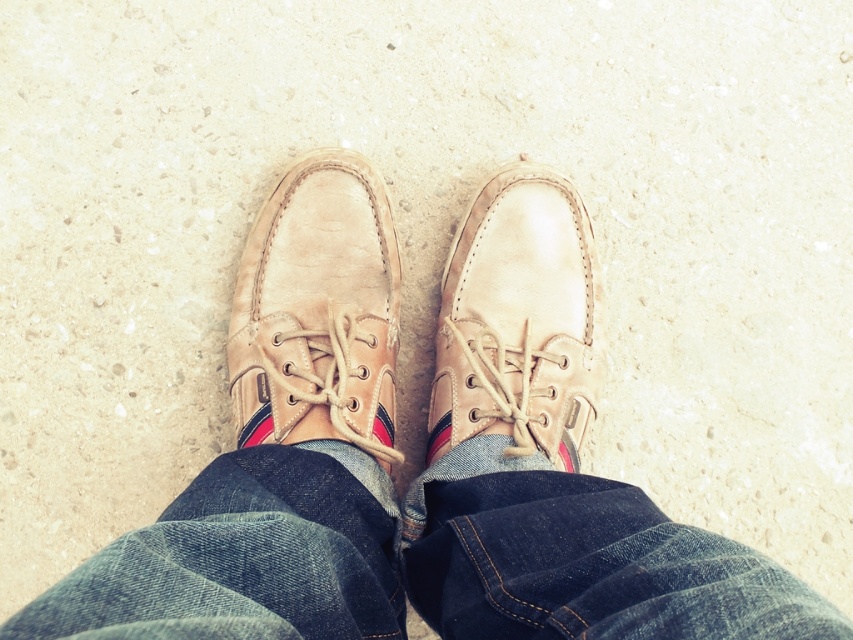
Does denim at center have a greater width compared to leather shoe at center?

Yes.

Is point (682, 588) closer to camera compared to point (277, 328)?

Yes.

This screenshot has width=853, height=640. I want to click on denim at center, so click(419, 557).

Who is positioned more to the left, denim at center or tan leather shoe at center?

denim at center is more to the left.

This screenshot has height=640, width=853. What do you see at coordinates (419, 557) in the screenshot?
I see `denim at center` at bounding box center [419, 557].

Identify the location of denim at center. (419, 557).

Looking at this image, is leather shoe at center above tan leather shoe at center?

Indeed, leather shoe at center is positioned over tan leather shoe at center.

Does point (242, 378) lie in front of point (556, 298)?

Yes, it is.

Is point (337, 209) farther from viewer compared to point (566, 221)?

No, it is in front of (566, 221).

Locate an element on the screen. This screenshot has width=853, height=640. leather shoe at center is located at coordinates (318, 310).